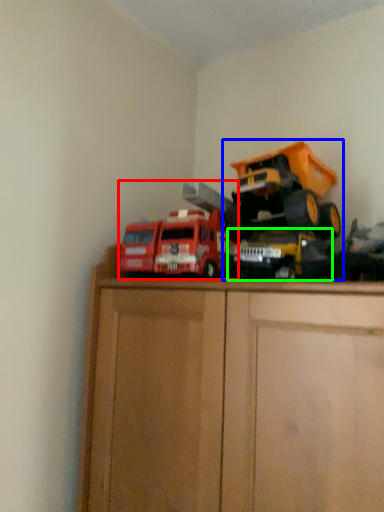
Question: Which object is positioned farthest from toy (highlighted by a red box)? Select from toy (highlighted by a blue box) and toy (highlighted by a green box).

Choices:
 (A) toy
 (B) toy

Answer: (A)